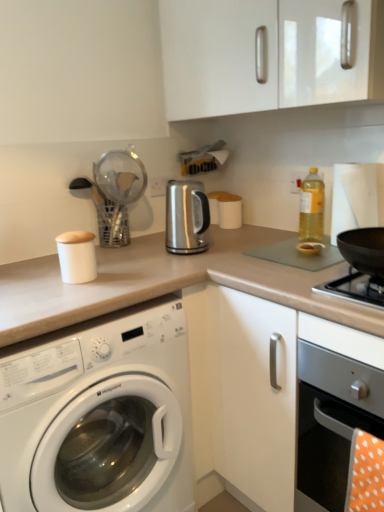
Question: From the image's perspective, relative to white glossy washing machine at lower left, is black matte wok at right above or below?

Choices:
 (A) below
 (B) above

Answer: (B)

Question: In the image, is black matte wok at right on the left side or the right side of white glossy washing machine at lower left?

Choices:
 (A) left
 (B) right

Answer: (B)

Question: Estimate the real-world distances between objects in this image. Which object is closer to the white glossy washing machine at lower left?

Choices:
 (A) white glossy cabinet at upper center
 (B) satin metallic kettle at center, which is counted as the first appliance, starting from the right
 (C) white matte canister at left, the 1th appliance from the left
 (D) yellow translucent bottle at upper right
 (E) satin silver oven at lower right

Answer: (C)

Question: Considering the real-world distances, which object is closest to the white matte canister at left, the 1th appliance positioned from the front?

Choices:
 (A) black matte wok at right
 (B) white glossy cabinet at upper center
 (C) yellow translucent bottle at upper right
 (D) satin metallic kettle at center, which is counted as the first appliance, starting from the right
 (E) satin silver oven at lower right

Answer: (D)